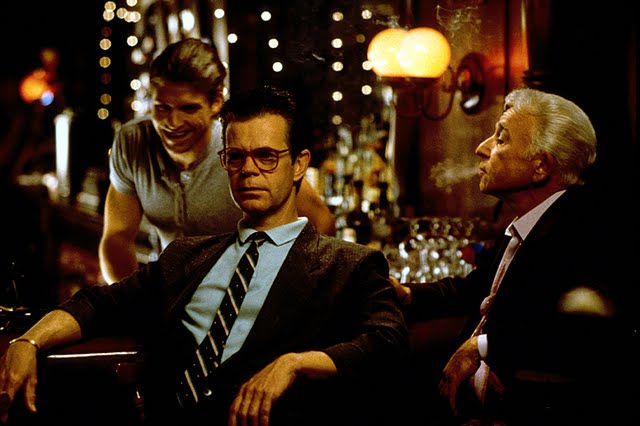
Where is `fancy lights`? Image resolution: width=640 pixels, height=426 pixels. fancy lights is located at coordinates (339, 41), (269, 57), (269, 21), (348, 88), (232, 45).